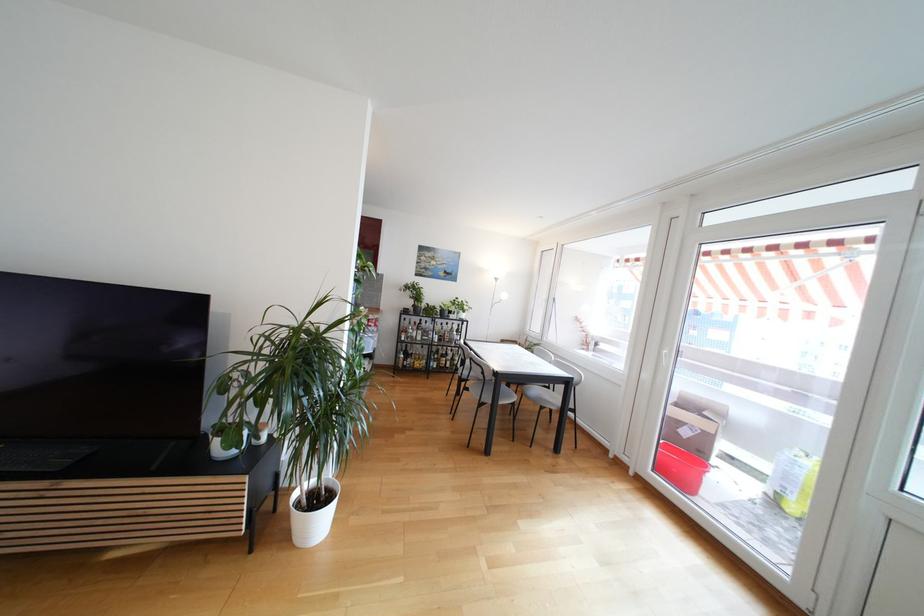
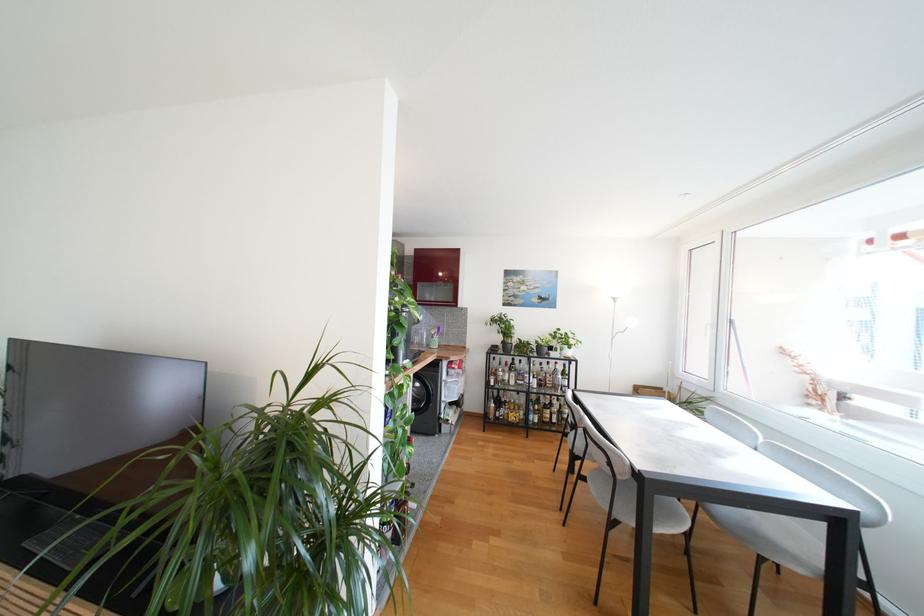
In the second image, find the point that corresponds to (x=470, y=391) in the first image.

(589, 480)